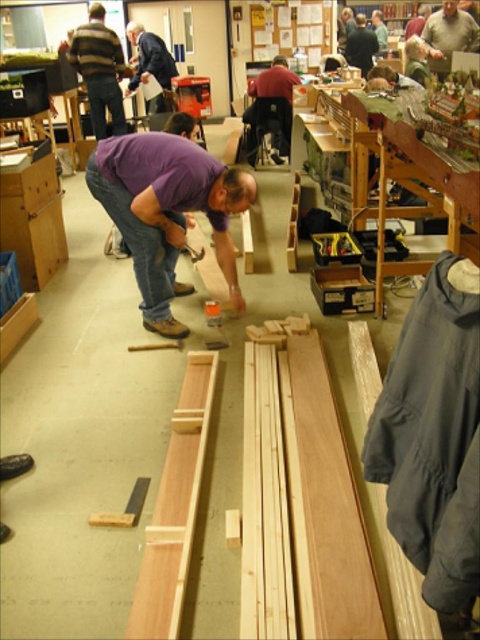
You are standing in the workshop and see two points marked on the floor. The first point is at coordinates point (x=193, y=150) and the second point is at point (x=257, y=74). If you want to move from the first point to the second point, which direction should you move in relation to the workshop layout?

Point (x=193, y=150) is in front of point (x=257, y=74). To move from the first point to the second point, you should move backward in the workshop layout.